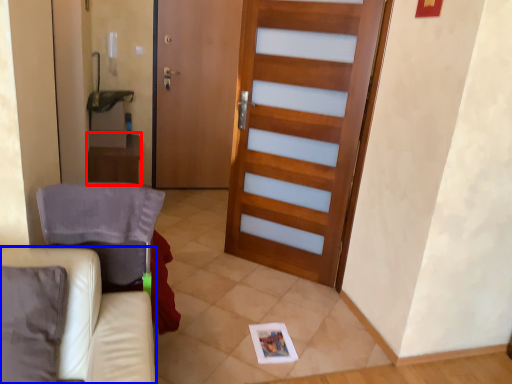
Question: Which of the following is the closest to the observer, table (highlighted by a red box) or furniture (highlighted by a blue box)?

Choices:
 (A) table
 (B) furniture

Answer: (B)